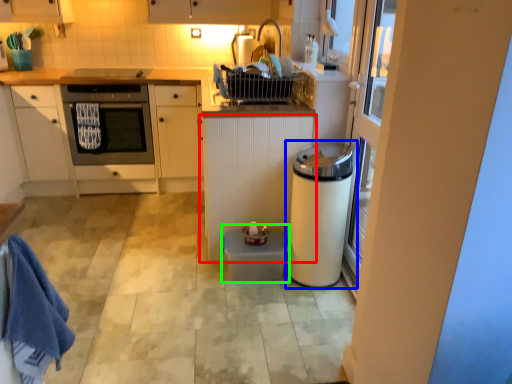
Question: Estimate the real-world distances between objects in this image. Which object is farther from cabinetry (highlighted by a red box), kitchen appliance (highlighted by a blue box) or water heater (highlighted by a green box)?

Choices:
 (A) kitchen appliance
 (B) water heater

Answer: (B)